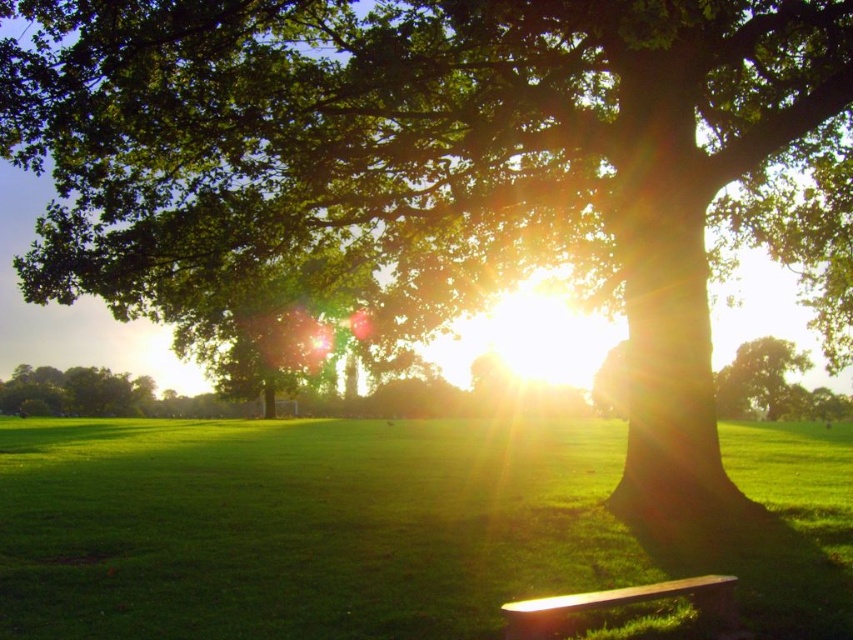
Who is more forward, (709, 580) or (764, 364)?

Point (709, 580)

Who is more distant from viewer, [558,616] or [770,413]?

Positioned behind is point [770,413].

Find the location of a particular element. This screenshot has width=853, height=640. black matte bench at lower center is located at coordinates (622, 604).

What do you see at coordinates (375, 525) in the screenshot? I see `green grassy at lower center` at bounding box center [375, 525].

Is green grassy at lower center shorter than green leafy tree at center?

Yes.

Is point (160, 440) closer to camera compared to point (730, 397)?

Yes, point (160, 440) is in front of point (730, 397).

Image resolution: width=853 pixels, height=640 pixels. I want to click on green grassy at lower center, so click(375, 525).

Is green grassy at lower center wider than black matte bench at lower center?

Correct, the width of green grassy at lower center exceeds that of black matte bench at lower center.

Between green grassy at lower center and black matte bench at lower center, which one has more height?

green grassy at lower center

I want to click on green grassy at lower center, so click(375, 525).